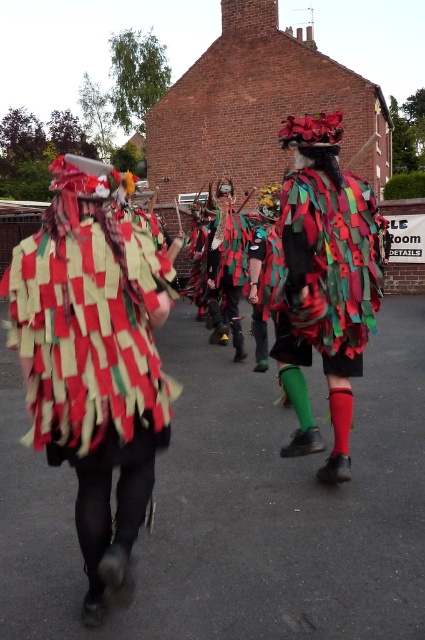
You are standing at the entrance of the LE Room DETAILS building and see the point marked at coordinates (93,358). What object is positioned at that point?

The textured fabric costume at center is located at point (93,358).

You are a photographer trying to capture the vibrant costumes in the festival. You notice two items at the center of the scene. Which one is positioned to the left when looking at the textured fabric costume at center and the textured fabric mask at center?

The textured fabric costume at center is positioned to the left of the textured fabric mask at center.

You are a photographer trying to capture the textured fabric costume at center and the textured fabric mask at center in a single shot. Since you want both to be clear, which one should you focus on first to ensure sharpness?

The textured fabric costume at center is closer to the viewer than the textured fabric mask at center. To ensure both are sharp, focus on the textured fabric costume at center first, as it is closer, and the mask will fall into focus automatically if within the depth of field.